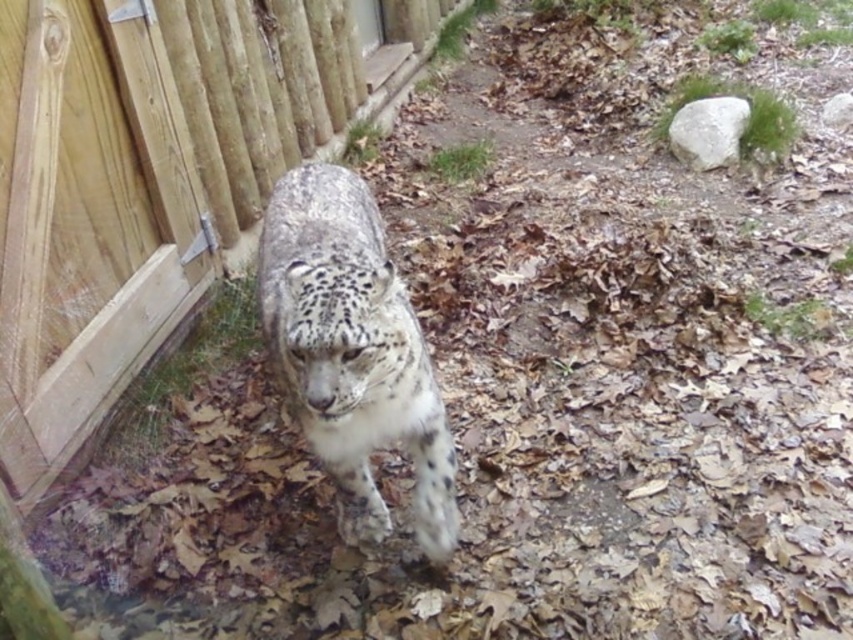
You are a zookeeper who needs to feed the spotted fur snow leopard at center. The wooden fence at left is part of its enclosure. Can you safely approach the leopard from the left side without getting too close? Explain your reasoning.

The wooden fence at left is 34.12 inches from the spotted fur snow leopard at center. Since the leopard is at the center and the fence is on the left, maintaining a safe distance of at least 34.12 inches would allow you to approach from the left side without entering the leopard enclosure. However, zookeeper safety protocols typically require staying further away, so additional precautions are necessary.